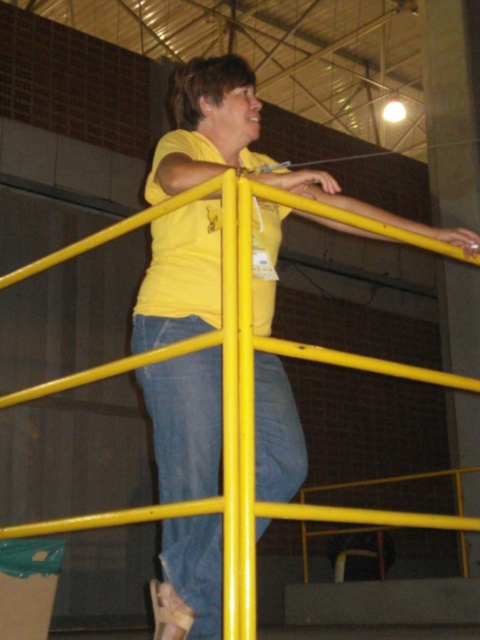
You are designing a mascot costume for an event and need to ensure the mascot can comfortably wear both the yellow matte shirt at upper center and the denim at center. Based on the image, which item might require adjustments to accommodate the mascot if they have a larger upper body?

The yellow matte shirt at upper center has a larger size compared to denim at center, so if the mascot has a larger upper body, the denim at center might need adjustments to fit properly.